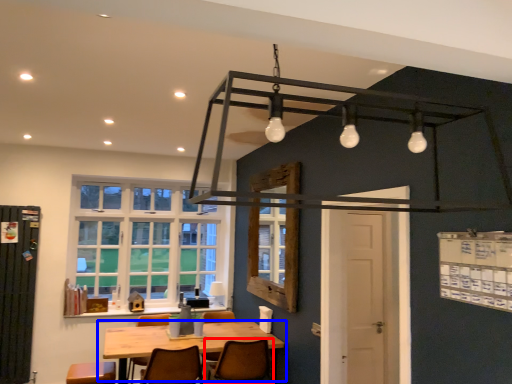
Question: Which object is closer to the camera taking this photo, chair (highlighted by a red box) or table (highlighted by a blue box)?

Choices:
 (A) chair
 (B) table

Answer: (B)